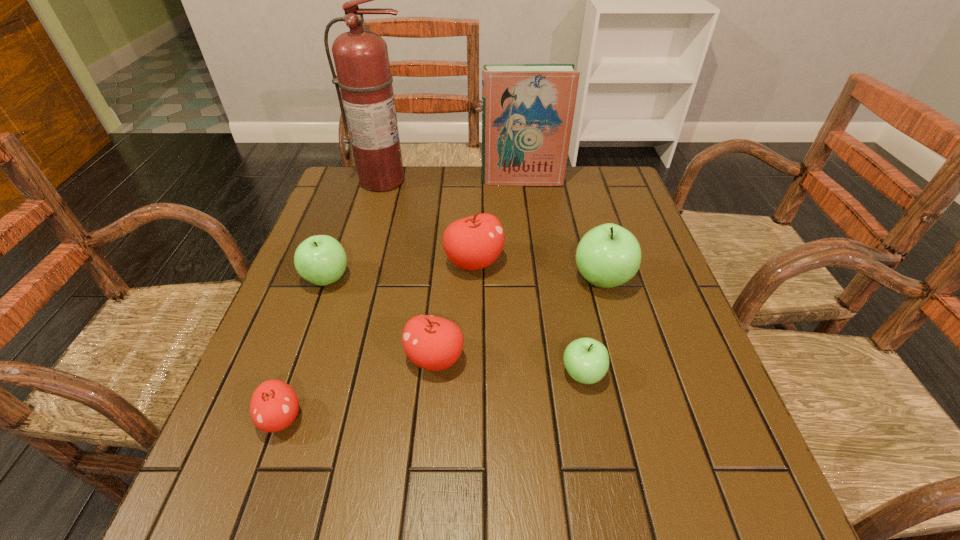
This screenshot has height=540, width=960. Find the location of `the tallest object`. the tallest object is located at coordinates (361, 59).

Locate an element on the screen. hardback book is located at coordinates (527, 109).

Where is `the biggest green apple`? the biggest green apple is located at coordinates (607, 256).

Find the location of `the farthest red apple`. the farthest red apple is located at coordinates (472, 243).

This screenshot has height=540, width=960. Find the location of `the leftmost green apple`. the leftmost green apple is located at coordinates (320, 259).

The image size is (960, 540). Identify the location of the second biggest red apple. (433, 343).

This screenshot has height=540, width=960. I want to click on the smallest green apple, so click(x=586, y=360).

Locate an element on the screen. This screenshot has width=960, height=540. the smallest red apple is located at coordinates (274, 406).

The image size is (960, 540). I want to click on the nearest apple, so click(x=274, y=406).

Where is `free space located 0.380m on the front-facing side of the fire extinguisher`? free space located 0.380m on the front-facing side of the fire extinguisher is located at coordinates (353, 284).